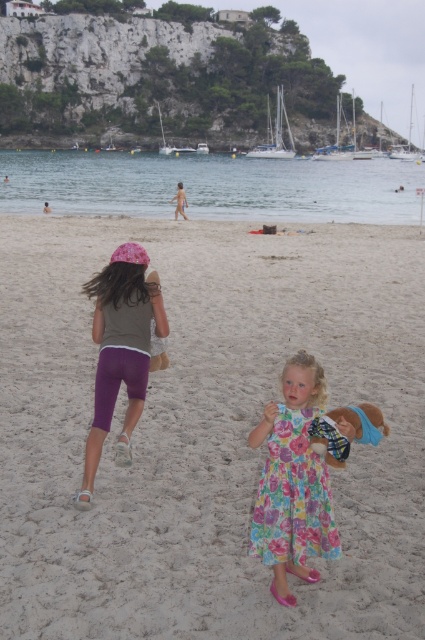
Question: Can you confirm if floral dress at center is smaller than matte purple shorts at left?

Choices:
 (A) yes
 (B) no

Answer: (B)

Question: Which object is farther from the camera taking this photo?

Choices:
 (A) matte purple shorts at left
 (B) light beige sand at center
 (C) floral dress at center

Answer: (A)

Question: Which of the following is the closest to the observer?

Choices:
 (A) light beige sand at center
 (B) matte purple shorts at left

Answer: (A)

Question: Does floral dress at center have a greater width compared to matte purple shorts at left?

Choices:
 (A) no
 (B) yes

Answer: (B)

Question: Which object appears farthest from the camera in this image?

Choices:
 (A) light beige sand at center
 (B) floral dress at center
 (C) matte purple shorts at left

Answer: (C)

Question: Is light beige sand at center behind matte purple shorts at left?

Choices:
 (A) yes
 (B) no

Answer: (B)